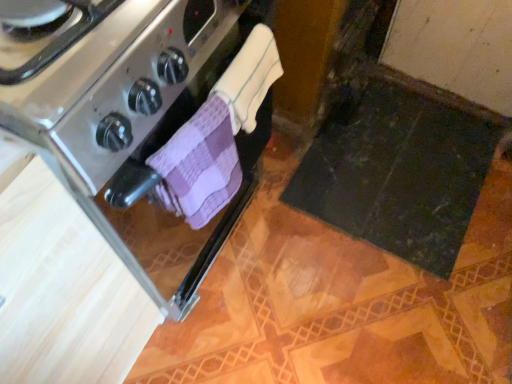
Question: Does purple checkered cloth at center, placed as the second bath towel when sorted from top to bottom, have a larger size compared to stainless steel oven at left?

Choices:
 (A) no
 (B) yes

Answer: (A)

Question: Is purple checkered cloth at center, placed as the second bath towel when sorted from top to bottom, oriented towards stainless steel oven at left?

Choices:
 (A) yes
 (B) no

Answer: (B)

Question: Can you confirm if purple checkered cloth at center, placed as the second bath towel when sorted from top to bottom, is shorter than stainless steel oven at left?

Choices:
 (A) yes
 (B) no

Answer: (A)

Question: Is the position of purple checkered cloth at center, placed as the second bath towel when sorted from top to bottom, less distant than that of stainless steel oven at left?

Choices:
 (A) no
 (B) yes

Answer: (A)

Question: Does purple checkered cloth at center, placed as the second bath towel when sorted from top to bottom, touch stainless steel oven at left?

Choices:
 (A) no
 (B) yes

Answer: (A)

Question: Does purple checkered cloth at center, marked as the 1th bath towel in a bottom-to-top arrangement, have a greater width compared to stainless steel oven at left?

Choices:
 (A) no
 (B) yes

Answer: (A)

Question: Does stainless steel oven at left lie behind purple checkered cloth at center, marked as the 1th bath towel in a bottom-to-top arrangement?

Choices:
 (A) yes
 (B) no

Answer: (B)

Question: Considering the relative sizes of stainless steel oven at left and purple checkered cloth at center, placed as the second bath towel when sorted from top to bottom, in the image provided, is stainless steel oven at left taller than purple checkered cloth at center, placed as the second bath towel when sorted from top to bottom,?

Choices:
 (A) no
 (B) yes

Answer: (B)

Question: From the image's perspective, is stainless steel oven at left on purple checkered cloth at center, placed as the second bath towel when sorted from top to bottom?

Choices:
 (A) no
 (B) yes

Answer: (B)

Question: Can you confirm if stainless steel oven at left is thinner than purple checkered cloth at center, placed as the second bath towel when sorted from top to bottom?

Choices:
 (A) no
 (B) yes

Answer: (A)

Question: Is stainless steel oven at left beside purple checkered cloth at center, marked as the 1th bath towel in a bottom-to-top arrangement?

Choices:
 (A) no
 (B) yes

Answer: (A)

Question: From a real-world perspective, does stainless steel oven at left sit lower than purple checkered cloth at center, marked as the 1th bath towel in a bottom-to-top arrangement?

Choices:
 (A) yes
 (B) no

Answer: (A)

Question: Is white terry cloth towel at center, the 2th bath towel from the bottom, bigger than stainless steel oven at left?

Choices:
 (A) no
 (B) yes

Answer: (A)